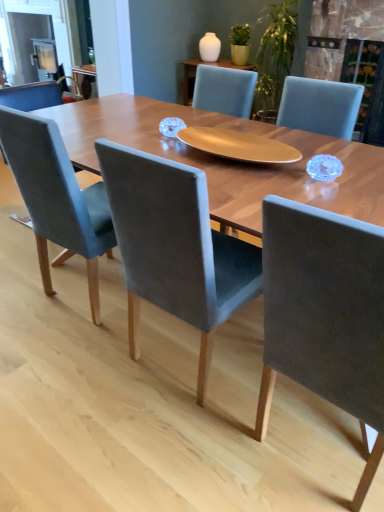
This screenshot has height=512, width=384. I want to click on free location to the left of velvet grey chair at left, acting as the 3th chair starting from the right, so click(33, 298).